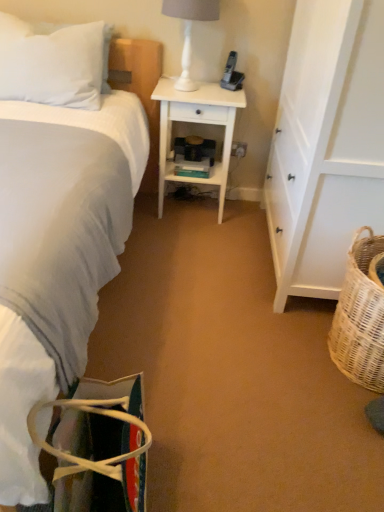
This screenshot has width=384, height=512. Find the location of `free space in front of white wood desk at center`. free space in front of white wood desk at center is located at coordinates (200, 242).